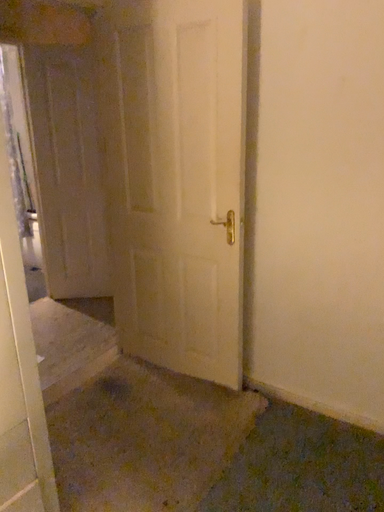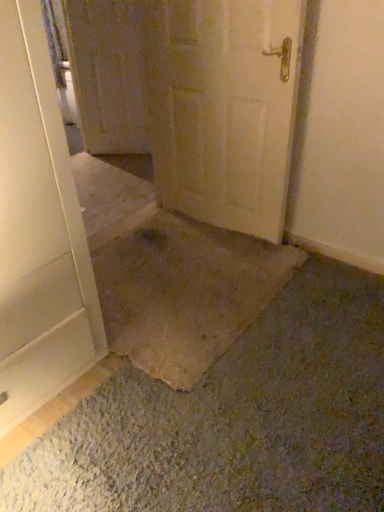
Question: Which way did the camera rotate in the video?

Choices:
 (A) rotated downward
 (B) rotated upward

Answer: (A)